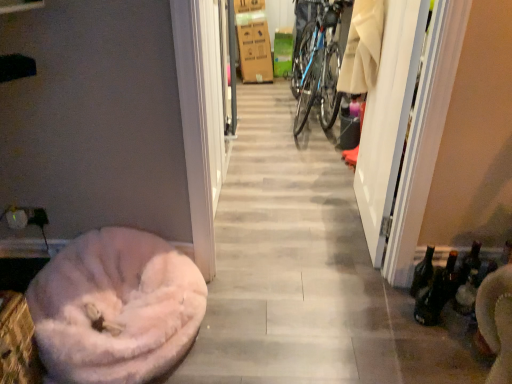
Identify the location of free space to the right of fuzzy pink dog bed at lower left. The image size is (512, 384). (267, 331).